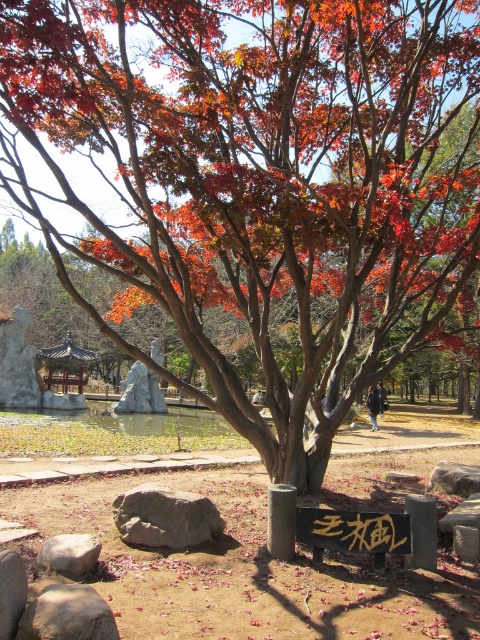
Does smooth gray rock at lower left have a lesser width compared to gray rough stone at lower left?

In fact, smooth gray rock at lower left might be wider than gray rough stone at lower left.

Looking at this image, who is lower down, smooth gray rock at lower left or gray rough stone at lower left?

Positioned lower is gray rough stone at lower left.

Which is in front, point (34, 636) or point (91, 548)?

Point (34, 636) is in front.

This screenshot has width=480, height=640. I want to click on smooth gray rock at lower left, so click(x=68, y=614).

Does gray rough rock at center have a greater height compared to black stone sign at center?

Indeed, gray rough rock at center has a greater height compared to black stone sign at center.

Can you confirm if gray rough rock at center is positioned below black stone sign at center?

No, gray rough rock at center is not below black stone sign at center.

Is point (193, 531) positioned in front of point (339, 529)?

That is False.

Where is `gray rough rock at center`? The image size is (480, 640). gray rough rock at center is located at coordinates (165, 516).

Is point (171, 540) farther from viewer compared to point (50, 538)?

Yes.

Is gray rough rock at center shorter than gray rough stone at lower left?

No, gray rough rock at center is not shorter than gray rough stone at lower left.

What do you see at coordinates (165, 516) in the screenshot? The image size is (480, 640). I see `gray rough rock at center` at bounding box center [165, 516].

I want to click on gray rough rock at center, so click(x=165, y=516).